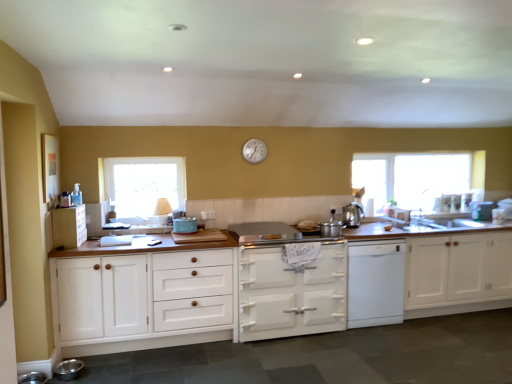
Locate an element on the screen. The image size is (512, 384). white wood cabinet at left, the 4th cabinetry from the right is located at coordinates (69, 227).

The height and width of the screenshot is (384, 512). What are the coordinates of `white matte dishwasher at center` in the screenshot? It's located at (376, 283).

What do you see at coordinates (291, 293) in the screenshot? The height and width of the screenshot is (384, 512). I see `white glossy stove at center, positioned as the 3th cabinetry in left-to-right order` at bounding box center [291, 293].

At what (x,y) coordinates should I click in order to perform the action: click on white wood cabinet at left, the first cabinetry when ordered from left to right. Please return your answer as a coordinate pair (x, y). Looking at the image, I should click on (69, 227).

Is matte blue crockery at center, acting as the 3th appliance starting from the front, touching clear glass window at upper right, placed as the first window when sorted from right to left?

No, matte blue crockery at center, acting as the 3th appliance starting from the front, is not beside clear glass window at upper right, placed as the first window when sorted from right to left.

Is matte blue crockery at center, placed as the third appliance when sorted from top to bottom, positioned with its back to clear glass window at upper right, which ranks as the 2th window in left-to-right order?

That's not correct — matte blue crockery at center, placed as the third appliance when sorted from top to bottom, is not looking away from clear glass window at upper right, which ranks as the 2th window in left-to-right order.

Does matte blue crockery at center, placed as the third appliance when sorted from top to bottom, contain clear glass window at upper right, placed as the first window when sorted from right to left?

Definitely not — clear glass window at upper right, placed as the first window when sorted from right to left, is not inside matte blue crockery at center, placed as the third appliance when sorted from top to bottom.

Is point (385, 302) farther from viewer compared to point (151, 265)?

Yes, it is.

Does white matte dishwasher at center touch white wood cabinet at left, the third cabinetry positioned from the right?

No, white matte dishwasher at center is not in contact with white wood cabinet at left, the third cabinetry positioned from the right.

What's the angular difference between white matte dishwasher at center and white wood cabinet at left, the third cabinetry positioned from the right,'s facing directions?

The angle between the facing direction of white matte dishwasher at center and the facing direction of white wood cabinet at left, the third cabinetry positioned from the right, is 0.000449 degrees.

Are matte blue crockery at center, the fourth appliance from the right, and silver metallic pots at center, which is counted as the second appliance, starting from the bottom, making contact?

No, matte blue crockery at center, the fourth appliance from the right, is not touching silver metallic pots at center, which is counted as the second appliance, starting from the bottom.

Is matte blue crockery at center, acting as the 3th appliance starting from the front, wider than silver metallic pots at center, which is the third appliance from right to left?

Yes.

Considering the points (179, 220) and (331, 209), which point is in front, point (179, 220) or point (331, 209)?

Point (179, 220)

Looking at this image, between matte blue crockery at center, placed as the third appliance when sorted from top to bottom, and silver metallic pots at center, which is the third appliance from right to left, which one has more height?

silver metallic pots at center, which is the third appliance from right to left, is taller.

Is white matte dishwasher at center situated inside clear glass window at left, marked as the second window in a right-to-left arrangement, or outside?

white matte dishwasher at center lies outside clear glass window at left, marked as the second window in a right-to-left arrangement.

From the image's perspective, is white matte dishwasher at center above or below clear glass window at left, marked as the second window in a right-to-left arrangement?

From the image's perspective, white matte dishwasher at center appears below clear glass window at left, marked as the second window in a right-to-left arrangement.

Is white matte dishwasher at center not close to clear glass window at left, which appears as the 1th window when viewed from the left?

Yes, white matte dishwasher at center and clear glass window at left, which appears as the 1th window when viewed from the left, are quite far apart.

Is point (381, 244) positioned before point (137, 195)?

Yes, point (381, 244) is in front of point (137, 195).

Between point (262, 157) and point (406, 280), which one is positioned behind?

Positioned behind is point (262, 157).

Would you say silver metallic clock at upper center is outside white wood cabinet at right, placed as the 4th cabinetry when sorted from left to right?

That's correct, silver metallic clock at upper center is outside of white wood cabinet at right, placed as the 4th cabinetry when sorted from left to right.

Would you say silver metallic clock at upper center is a long distance from white wood cabinet at right, positioned as the 1th cabinetry in right-to-left order?

Indeed, silver metallic clock at upper center is not near white wood cabinet at right, positioned as the 1th cabinetry in right-to-left order.

Considering the relative sizes of silver metallic clock at upper center and white wood cabinet at right, positioned as the 1th cabinetry in right-to-left order, in the image provided, is silver metallic clock at upper center shorter than white wood cabinet at right, positioned as the 1th cabinetry in right-to-left order,?

Yes, silver metallic clock at upper center is shorter than white wood cabinet at right, positioned as the 1th cabinetry in right-to-left order.

Consider the image. Which is closer, (328, 229) or (473, 217)?

Point (328, 229) appears to be closer to the viewer than point (473, 217).

Is the depth of silver metallic pots at center, arranged as the 3th appliance when viewed from the left, greater than that of white glossy sink at right, which ranks as the fifth appliance in front-to-back order?

No.

Considering the sizes of objects silver metallic pots at center, which is counted as the second appliance, starting from the bottom, and white glossy sink at right, which appears as the 1th appliance when viewed from the top, in the image provided, who is taller, silver metallic pots at center, which is counted as the second appliance, starting from the bottom, or white glossy sink at right, which appears as the 1th appliance when viewed from the top,?

Standing taller between the two is white glossy sink at right, which appears as the 1th appliance when viewed from the top.

Starting from the clear glass window at left, which appears as the 1th window when viewed from the left, which appliance is the 1st one to the right? Please provide its 2D coordinates.

[(185, 225)]

From the image's perspective, which object appears higher, matte blue crockery at center, the fourth appliance from the right, or clear glass window at left, which appears as the 1th window when viewed from the left?

clear glass window at left, which appears as the 1th window when viewed from the left, appears higher in the image.

Does point (174, 219) come in front of point (148, 173)?

Yes, it is.

Which object is positioned more to the left, matte blue crockery at center, the 3th appliance positioned from the bottom, or clear glass window at left, marked as the 1th window in a front-to-back arrangement?

clear glass window at left, marked as the 1th window in a front-to-back arrangement.

Find the location of a particular element. the 3rd appliance below the clear glass window at upper right, arranged as the 1th window when viewed from the back (from the image's perspective) is located at coordinates (185, 225).

Locate an element on the screen. dish washer that appears on the right of white wood cabinet at left, the third cabinetry positioned from the right is located at coordinates (376, 283).

Considering their positions, is white wood cabinet at right, placed as the 4th cabinetry when sorted from left to right, positioned further to white glossy stove at center, placed as the 2th cabinetry when sorted from right to left, than white matte dishwasher at center?

Based on the image, white wood cabinet at right, placed as the 4th cabinetry when sorted from left to right, appears to be further to white glossy stove at center, placed as the 2th cabinetry when sorted from right to left.

Consider the image. When comparing their distances from white matte dishwasher at center, does white wood cabinet at right, placed as the 4th cabinetry when sorted from left to right, or white wood cabinet at left, the first cabinetry when ordered from left to right, seem further?

white wood cabinet at left, the first cabinetry when ordered from left to right, lies further to white matte dishwasher at center than the other object.

From the image, which object appears to be nearer to white glossy sink at right, which is counted as the fifth appliance, starting from the left, white matte dishwasher at center or white glossy stove at center, positioned as the 3th cabinetry in left-to-right order?

Among the two, white matte dishwasher at center is located nearer to white glossy sink at right, which is counted as the fifth appliance, starting from the left.

Considering their positions, is white wood cabinet at right, placed as the 4th cabinetry when sorted from left to right, positioned further to silver metallic pots at center, which is the fourth appliance from top to bottom, than white glossy stove at center, positioned as the 3th cabinetry in left-to-right order?

white wood cabinet at right, placed as the 4th cabinetry when sorted from left to right.

Looking at this image, looking at the image, which one is located further to white glossy sink at right, the 5th appliance in the bottom-to-top sequence, white wood cabinet at right, positioned as the 1th cabinetry in right-to-left order, or clear glass window at left, marked as the 1th window in a front-to-back arrangement?

clear glass window at left, marked as the 1th window in a front-to-back arrangement, is positioned further to the anchor white glossy sink at right, the 5th appliance in the bottom-to-top sequence.

Considering their positions, is metallic stainless steel bowl at lower left, the 1th appliance when ordered from bottom to top, positioned further to white glossy sink at right, which ranks as the 1th appliance in right-to-left order, than silver metallic clock at upper center?

The object further to white glossy sink at right, which ranks as the 1th appliance in right-to-left order, is metallic stainless steel bowl at lower left, the 1th appliance when ordered from bottom to top.

Which object lies further to the anchor point silver metallic pots at center, arranged as the 3th appliance when viewed from the left, white glossy stove at center, placed as the 2th cabinetry when sorted from right to left, or polished stainless steel kettle at center right, acting as the 4th appliance starting from the left?

The object further to silver metallic pots at center, arranged as the 3th appliance when viewed from the left, is white glossy stove at center, placed as the 2th cabinetry when sorted from right to left.

When comparing their distances from white wood cabinet at right, placed as the 4th cabinetry when sorted from left to right, does white glossy sink at right, which appears as the 1th appliance when viewed from the back, or white glossy stove at center, positioned as the 3th cabinetry in left-to-right order, seem further?

white glossy stove at center, positioned as the 3th cabinetry in left-to-right order, is positioned further to the anchor white wood cabinet at right, placed as the 4th cabinetry when sorted from left to right.

At what (x,y) coordinates should I click in order to perform the action: click on dish washer between silver metallic clock at upper center and white glossy stove at center, placed as the 2th cabinetry when sorted from right to left, vertically. Please return your answer as a coordinate pair (x, y). Looking at the image, I should click on (376, 283).

Locate an element on the screen. dish washer between matte blue crockery at center, the 3th appliance positioned from the bottom, and clear glass window at upper right, placed as the first window when sorted from right to left, in the horizontal direction is located at coordinates (376, 283).

Locate an element on the screen. This screenshot has height=384, width=512. dish washer between silver metallic clock at upper center and white glossy sink at right, the 5th appliance in the bottom-to-top sequence, in the horizontal direction is located at coordinates pos(376,283).

The width and height of the screenshot is (512, 384). Identify the location of clock between white wood cabinet at left, acting as the 2th cabinetry starting from the left, and white wood cabinet at right, placed as the 4th cabinetry when sorted from left to right. (254, 151).